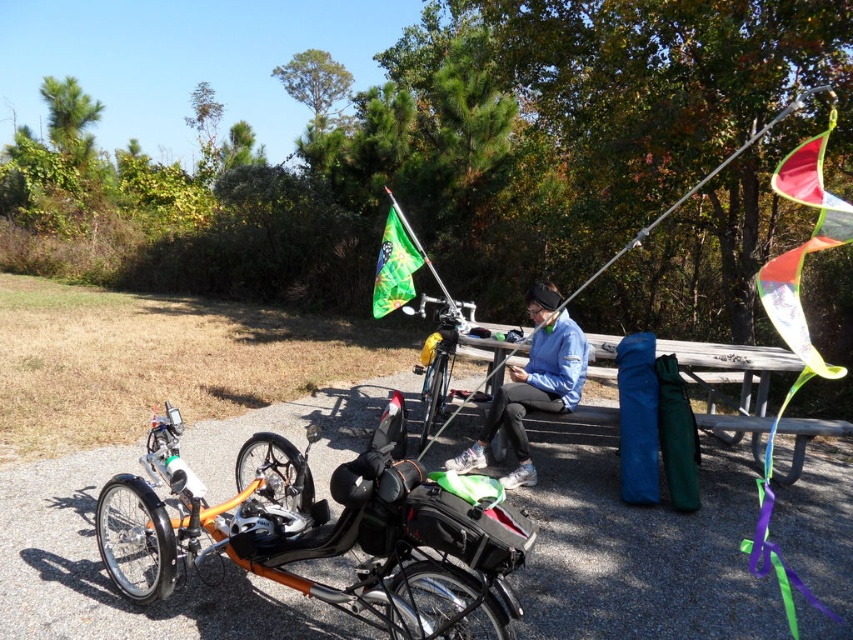
Looking at this image, you are standing at the entrance of a park and see both the blue fabric jacket at center and the green fabric flag at center. Which object is closer to you?

The blue fabric jacket at center is closer to you because it is in front of the green fabric flag at center.

You are planning to take a photo of the blue fabric jacket at center and the green fabric flag at center. Which object should you focus on first if you want to capture both in the frame without moving the camera?

You should focus on the blue fabric jacket at center first because it is larger in size than the green fabric flag at center, ensuring it fits well within the frame.

You are planning to take a photo of the orange matte trike at lower left and the green fabric flag at center from the right side of the picnic table. Which object will appear closer to the right edge of your photo?

The green fabric flag at center will appear closer to the right edge of the photo because the orange matte trike at lower left is positioned to the left of it.